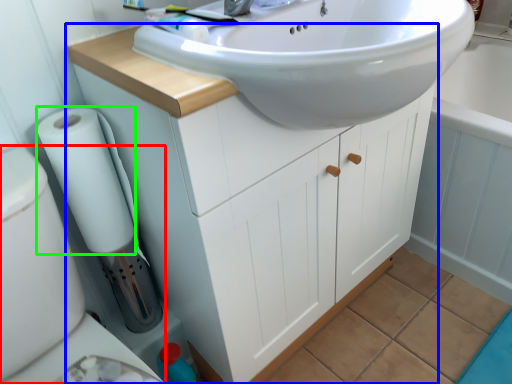
Question: Based on their relative distances, which object is nearer to bidet (highlighted by a red box)? Choose from bathroom cabinet (highlighted by a blue box) and toilet paper (highlighted by a green box).

Choices:
 (A) bathroom cabinet
 (B) toilet paper

Answer: (B)